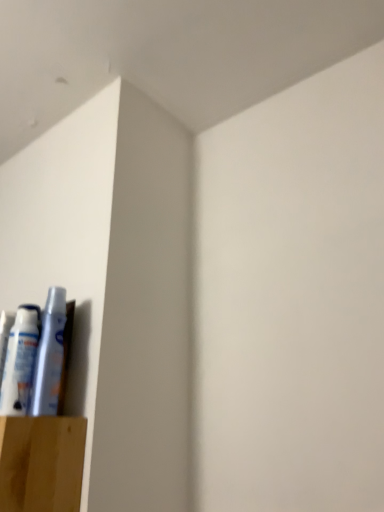
Question: Visually, is white plastic tube at lower left, positioned as the 2th toiletry in left-to-right order, positioned to the left or to the right of white matte tube at lower left, which is the first toiletry in left-to-right order?

Choices:
 (A) right
 (B) left

Answer: (A)

Question: Considering the positions of point (51, 347) and point (18, 387), is point (51, 347) closer or farther from the camera than point (18, 387)?

Choices:
 (A) farther
 (B) closer

Answer: (A)

Question: Is white plastic tube at lower left, arranged as the 1th toiletry when viewed from the right, inside the boundaries of white matte tube at lower left, which is the 2th toiletry from right to left, or outside?

Choices:
 (A) outside
 (B) inside

Answer: (A)

Question: Is white matte tube at lower left, which is the first toiletry in left-to-right order, taller or shorter than white plastic tube at lower left, arranged as the 1th toiletry when viewed from the right?

Choices:
 (A) tall
 (B) short

Answer: (B)

Question: Considering the positions of point (11, 406) and point (39, 395), is point (11, 406) closer or farther from the camera than point (39, 395)?

Choices:
 (A) farther
 (B) closer

Answer: (A)

Question: Is white matte tube at lower left, which is the first toiletry in left-to-right order, wider or thinner than white plastic tube at lower left, positioned as the 2th toiletry in left-to-right order?

Choices:
 (A) thin
 (B) wide

Answer: (B)

Question: Considering their positions, is white matte tube at lower left, which is the first toiletry in left-to-right order, located in front of or behind white plastic tube at lower left, positioned as the 2th toiletry in left-to-right order?

Choices:
 (A) front
 (B) behind

Answer: (B)